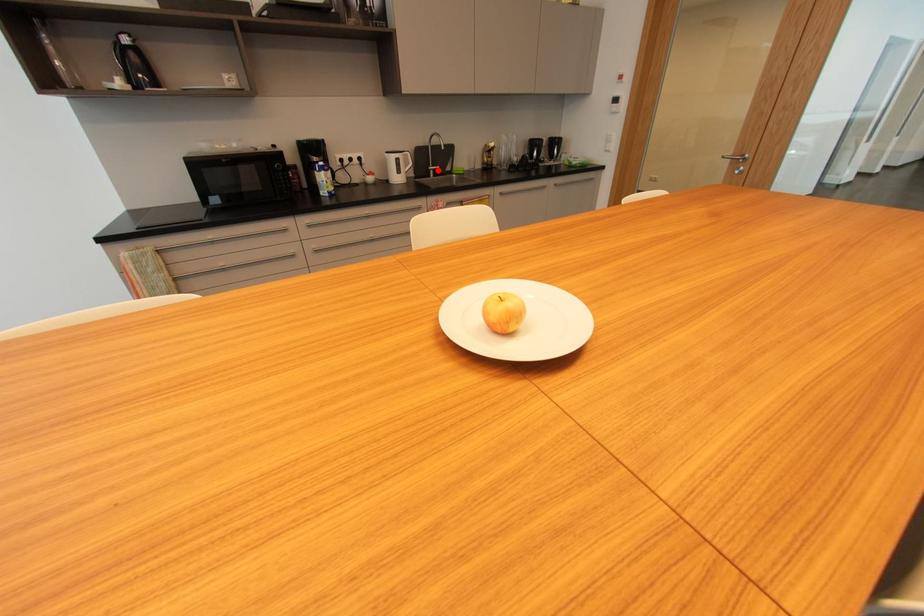
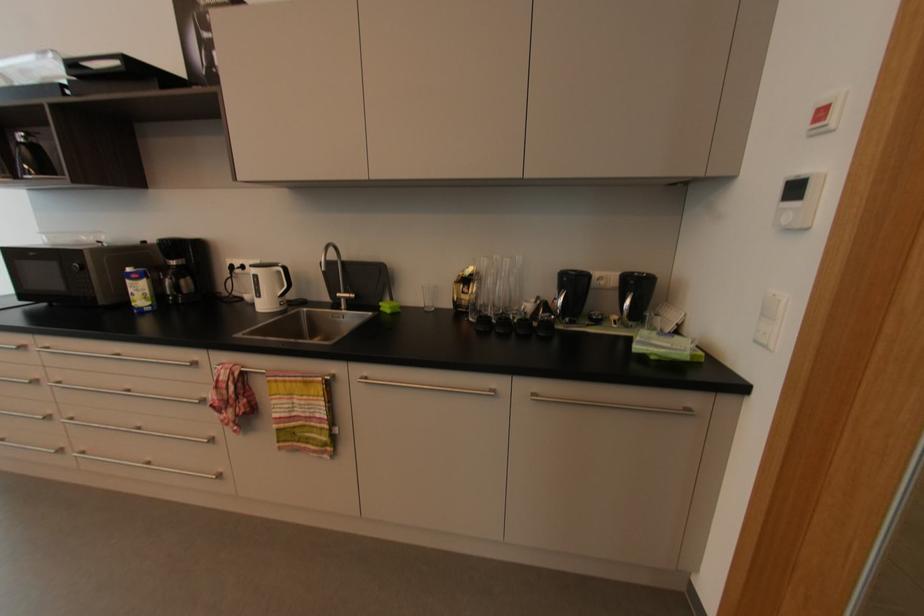
In the second image, find the point that corresponds to the highlighted location in the first image.

(350, 300)